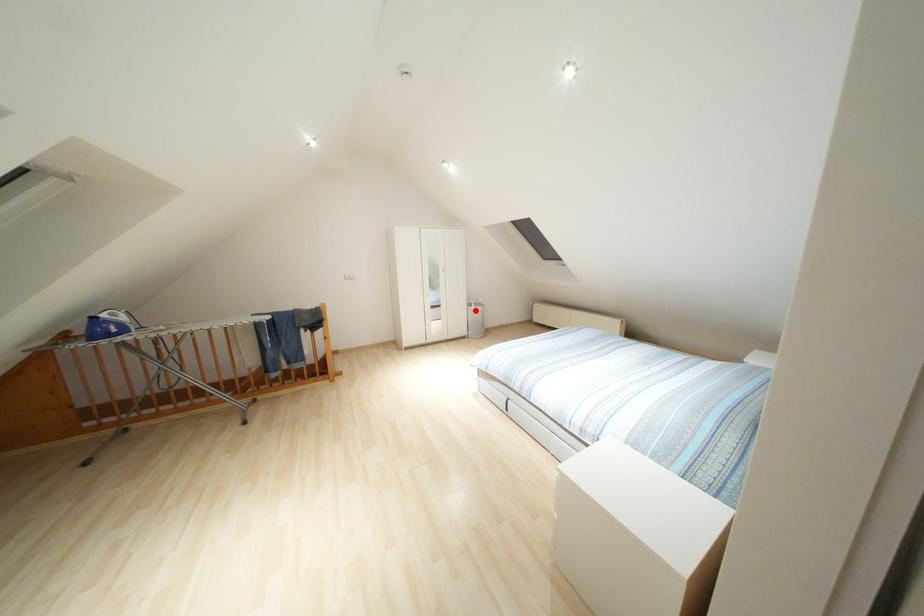
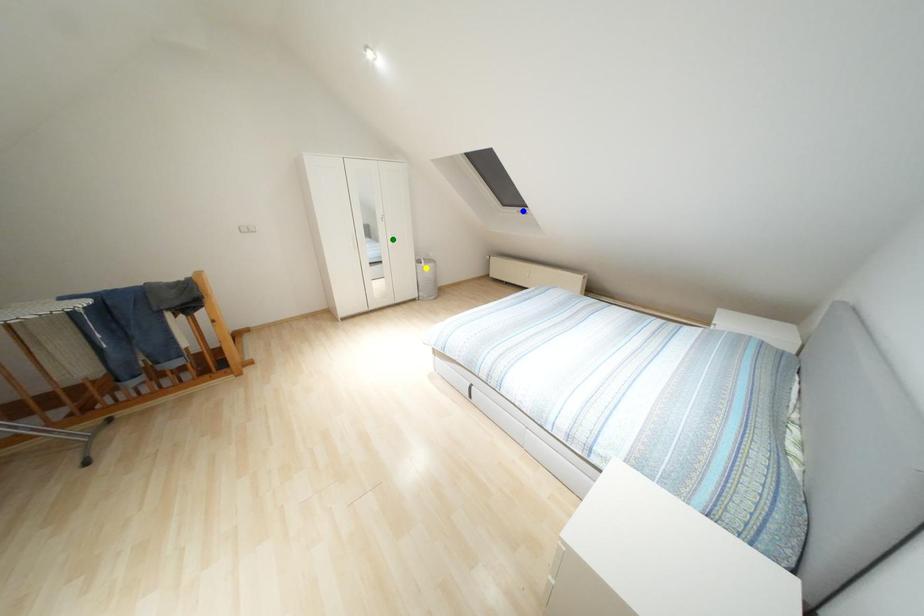
Question: I am providing you with two images of the same scene from different viewpoints. A red point is marked on the first image. You are given multiple points on the second image. In image 2, which mark is for the same physical point as the one in image 1?

Choices:
 (A) yellow point
 (B) green point
 (C) blue point

Answer: (A)